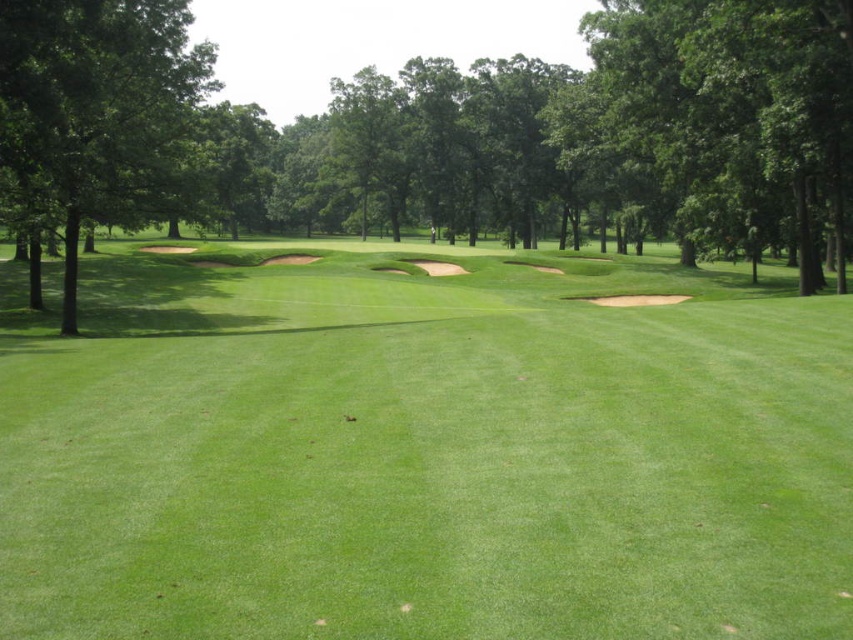
You are a golfer standing on the green grassy area in the foreground. You want to hit a ball towards the dense array of trees in the background. Which tree, the green leafy tree at center or the green leafy tree at left, will block your direct line of sight first?

The green leafy tree at center will block your direct line of sight first because the green leafy tree at left is behind the green leafy tree at center.

You are standing at the point labeled point (146, 369) and want to hit a golf ball towards the point labeled point (659, 0). Considering the golf course layout described, will your shot have an unobstructed path to the target point?

Yes, the shot from point (146, 369) to point (659, 0) has an unobstructed path because point (146, 369) is in front of point (659, 0), meaning there are no objects blocking the line of sight between them.

You are a golfer standing at the tee and want to hit your ball towards the green grassy fairway at center. Which direction should you aim relative to the green leafy tree at left?

You should aim to the right of the green leafy tree at left because the green grassy fairway at center is positioned on the right side of it.